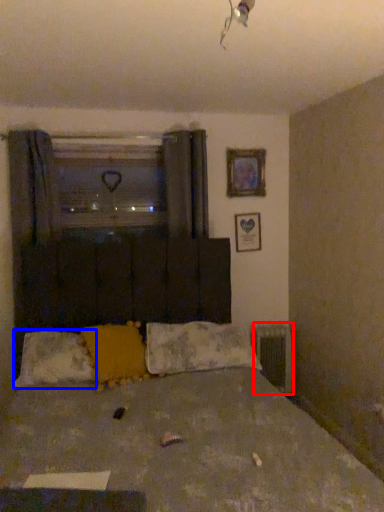
Question: Which object appears farthest to the camera in this image, radiator (highlighted by a red box) or pillow (highlighted by a blue box)?

Choices:
 (A) radiator
 (B) pillow

Answer: (A)